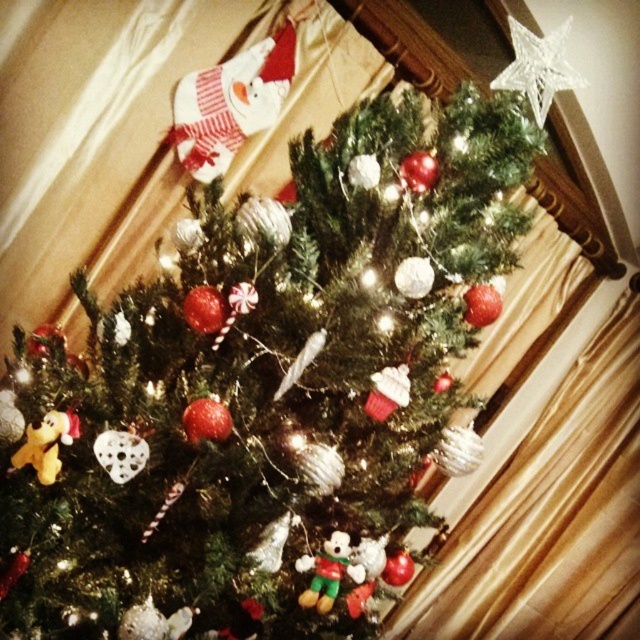
Between matte yellow plush bear at lower left and multicolored fabric plush at center, which one appears on the left side from the viewer's perspective?

matte yellow plush bear at lower left

Can you confirm if matte yellow plush bear at lower left is positioned above multicolored fabric plush at center?

Correct, matte yellow plush bear at lower left is located above multicolored fabric plush at center.

Is point (44, 440) closer to camera compared to point (323, 576)?

Yes, it is in front of point (323, 576).

Locate an element on the screen. matte yellow plush bear at lower left is located at coordinates (45, 444).